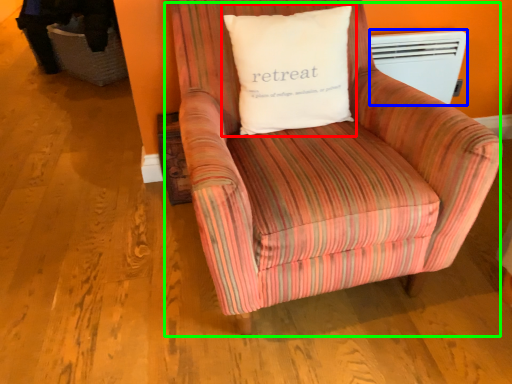
Question: Which object is the farthest from pillow (highlighted by a red box)? Choose among these: heater (highlighted by a blue box) or chair (highlighted by a green box).

Choices:
 (A) heater
 (B) chair

Answer: (A)